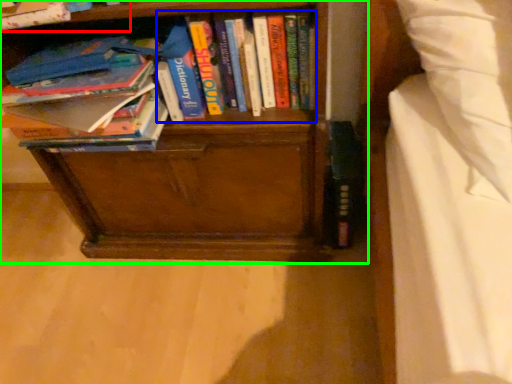
Question: Which object is positioned closest to book (highlighted by a red box)? Select from book (highlighted by a blue box) and bookcase (highlighted by a green box).

Choices:
 (A) book
 (B) bookcase

Answer: (A)